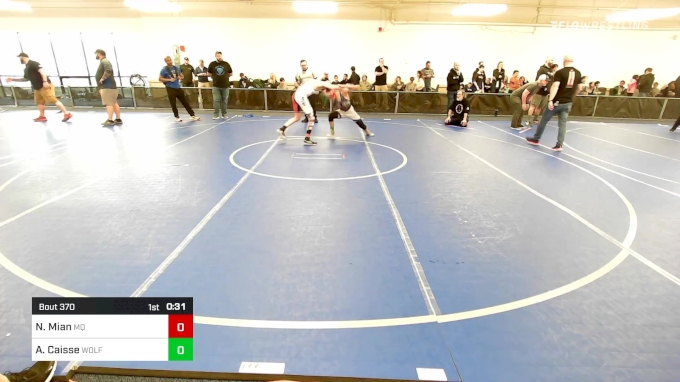
Locate an element on the screen. The height and width of the screenshot is (382, 680). walls is located at coordinates (626, 55), (251, 56).